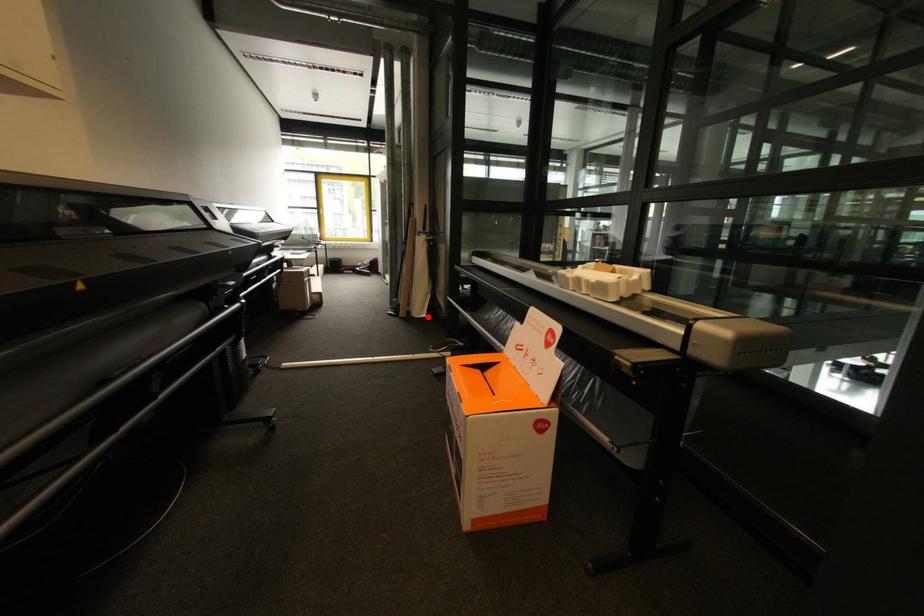
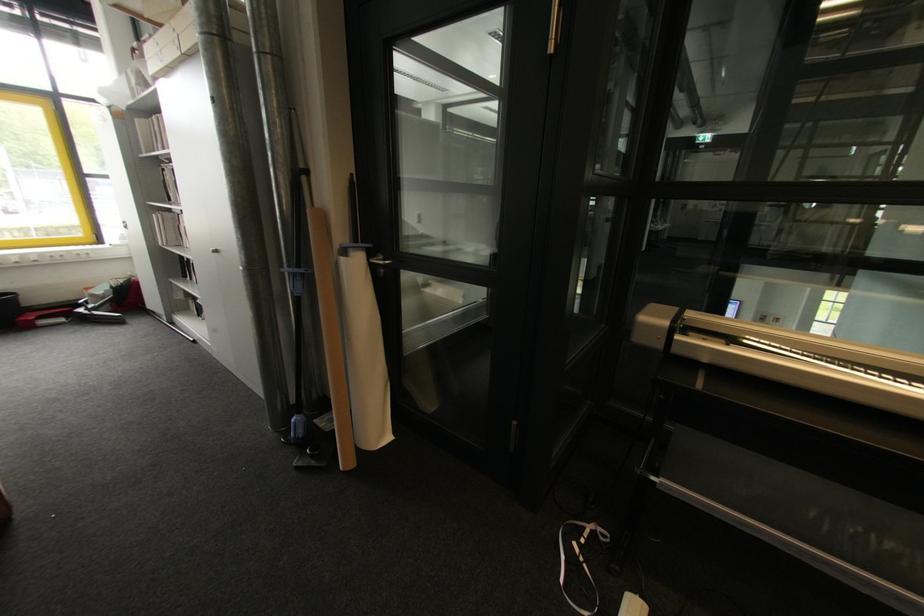
Where in the second image is the point corresponding to the highlighted location from the first image?

(393, 438)